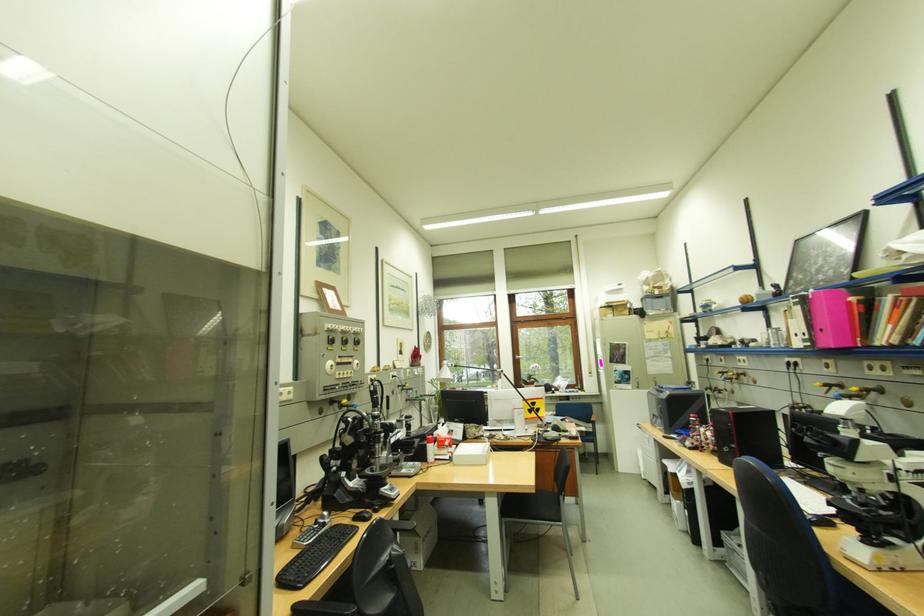
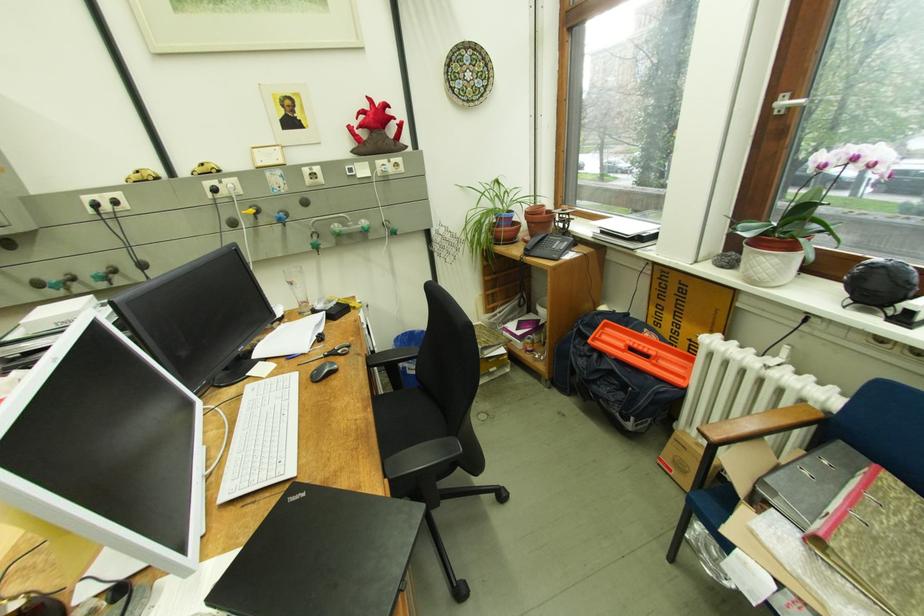
Find the pixel in the second image that matches point (528, 358) in the first image.

(794, 103)